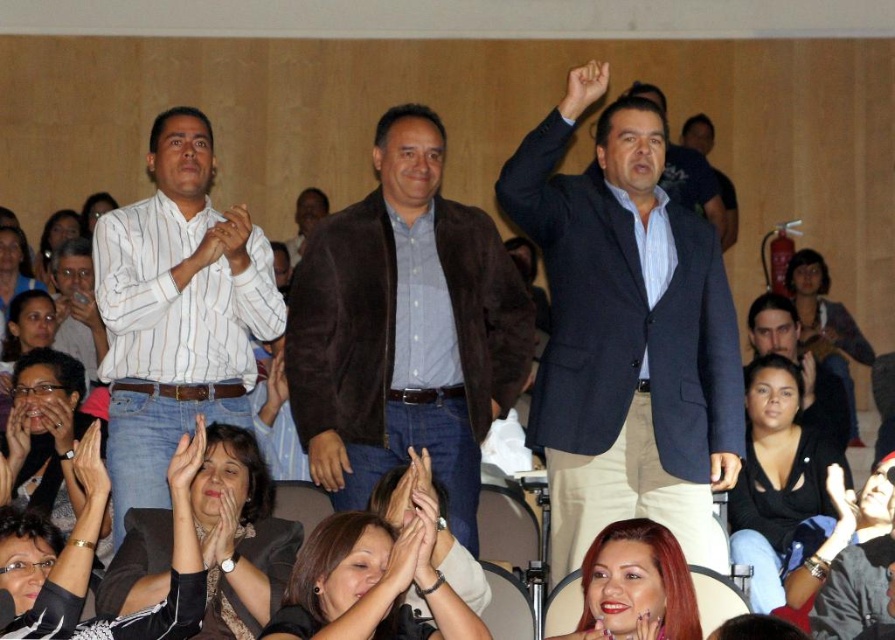
Question: Which object is positioned farthest from the white striped shirt at center?

Choices:
 (A) dark blue shirt at upper center
 (B) black fabric jacket at center
 (C) dark brown leather jacket at center

Answer: (A)

Question: Observing the image, what is the correct spatial positioning of black matte shirt at lower right in reference to dark blue shirt at upper center?

Choices:
 (A) above
 (B) below

Answer: (B)

Question: Which point is farther to the camera?

Choices:
 (A) white striped shirt at center
 (B) white shirt at left
 (C) smooth skin hands at center
 (D) dark blue suit at center

Answer: (B)

Question: Which of the following is the closest to the observer?

Choices:
 (A) (143, 625)
 (B) (848, 417)
 (C) (663, 488)

Answer: (A)

Question: Does black matte shirt at lower right have a larger size compared to black fabric jacket at center?

Choices:
 (A) no
 (B) yes

Answer: (B)

Question: Is the position of brown suede jacket at center less distant than that of blue suit at center?

Choices:
 (A) no
 (B) yes

Answer: (B)